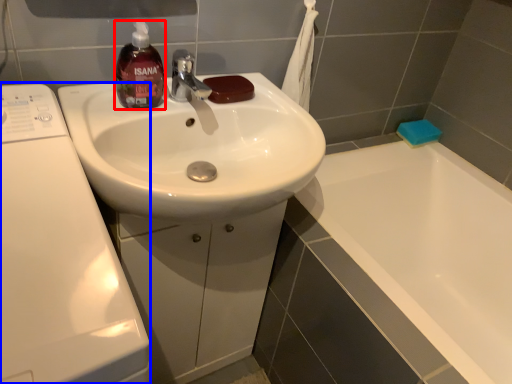
Question: Which object is closer to the camera taking this photo, mouthwash (highlighted by a red box) or washing machine (highlighted by a blue box)?

Choices:
 (A) mouthwash
 (B) washing machine

Answer: (B)